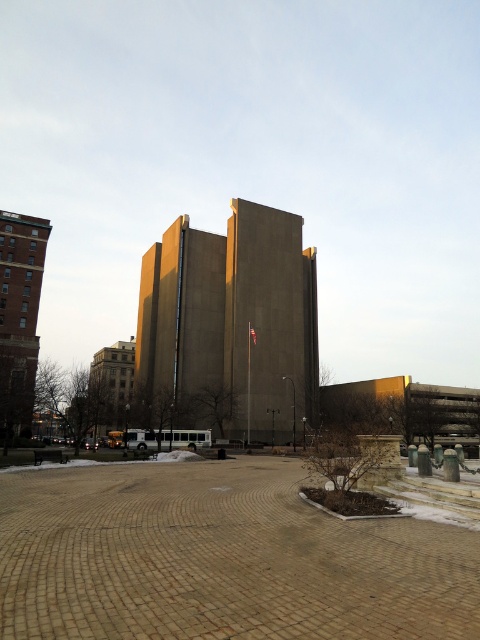
Question: Considering the relative positions of brown brick plaza at center and concrete building at center in the image provided, where is brown brick plaza at center located with respect to concrete building at center?

Choices:
 (A) above
 (B) below

Answer: (B)

Question: Which point is closer to the camera taking this photo?

Choices:
 (A) (137, 481)
 (B) (16, 349)
 (C) (311, 268)

Answer: (A)

Question: Which point appears farthest from the camera in this image?

Choices:
 (A) (274, 384)
 (B) (273, 584)

Answer: (A)

Question: Is concrete building at center thinner than brick tower at left?

Choices:
 (A) yes
 (B) no

Answer: (B)

Question: Which point is closer to the camera?

Choices:
 (A) (286, 499)
 (B) (144, 349)
 (C) (12, 250)

Answer: (A)

Question: Does concrete building at center have a smaller size compared to brick tower at left?

Choices:
 (A) yes
 (B) no

Answer: (B)